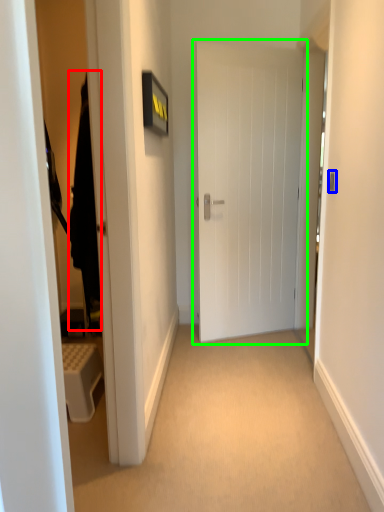
Question: Which is farther away from robe (highlighted by a red box)? door handle (highlighted by a blue box) or door (highlighted by a green box)?

Choices:
 (A) door handle
 (B) door

Answer: (B)